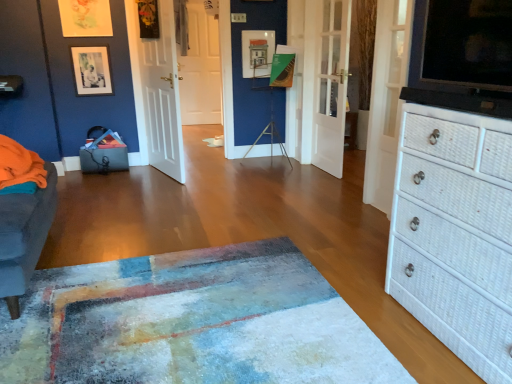
Question: From the image's perspective, is white wooden door at left, placed as the fourth door when sorted from right to left, positioned above or below white glossy door at center, the 2th door positioned from the right?

Choices:
 (A) below
 (B) above

Answer: (A)

Question: From a real-world perspective, is white wooden door at left, which appears as the third door when viewed from the back, physically located above or below white glossy door at center, placed as the third door when sorted from front to back?

Choices:
 (A) below
 (B) above

Answer: (B)

Question: Estimate the real-world distances between objects in this image. Which object is closer to the white wooden door at left, which ranks as the first door in left-to-right order?

Choices:
 (A) white matte door at center, which ranks as the 3th door in right-to-left order
 (B) white wicker chest of drawers at right
 (C) textured blue rug at center
 (D) white glossy door at center, the 2th door in the back-to-front sequence
 (E) matte black picture frame at upper left

Answer: (E)

Question: Which is nearer to the textured blue rug at center?

Choices:
 (A) white wicker chest of drawers at right
 (B) white glossy door at center, which is the 3th door from left to right
 (C) white textured door at upper right, the first door when ordered from front to back
 (D) matte black picture frame at upper left
 (E) white wooden door at left, placed as the fourth door when sorted from right to left

Answer: (A)